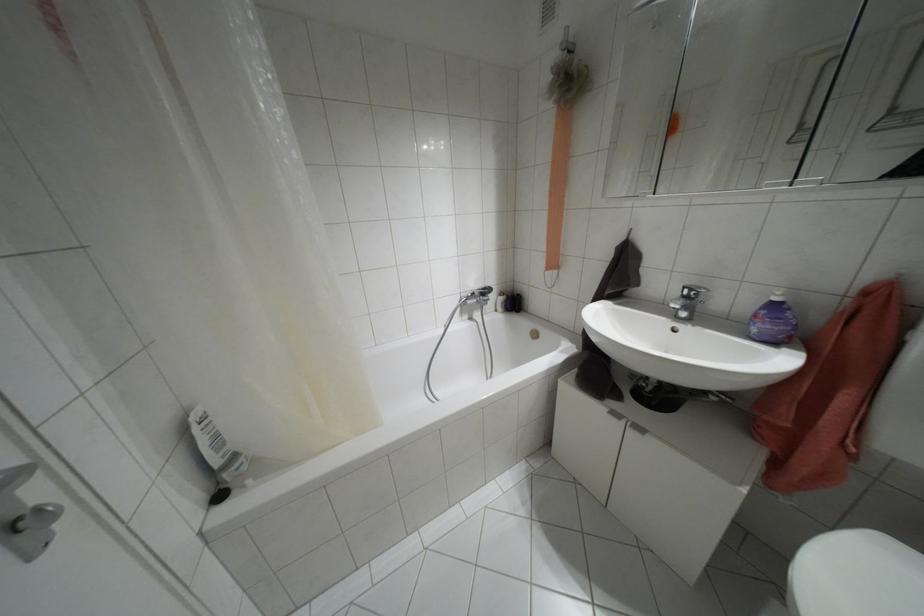
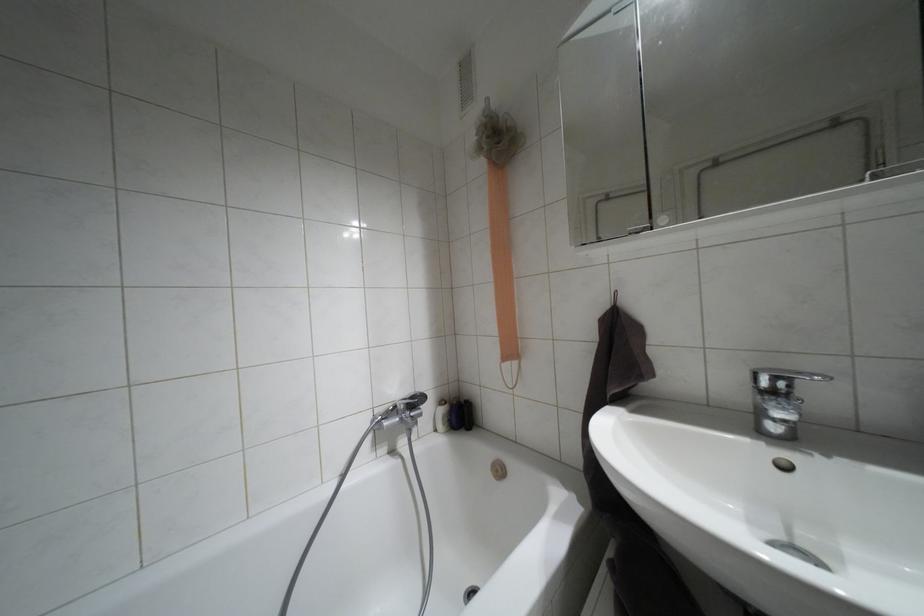
Question: In a continuous first-person perspective shot, in which direction is the camera moving?

Choices:
 (A) Left
 (B) Right
 (C) Forward
 (D) Backward

Answer: (C)